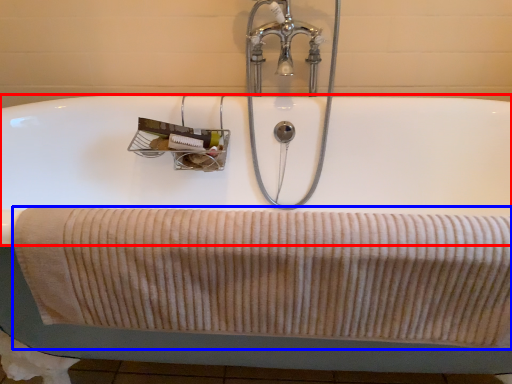
Question: Which of the following is the closest to the observer, bath (highlighted by a red box) or bath towel (highlighted by a blue box)?

Choices:
 (A) bath
 (B) bath towel

Answer: (B)